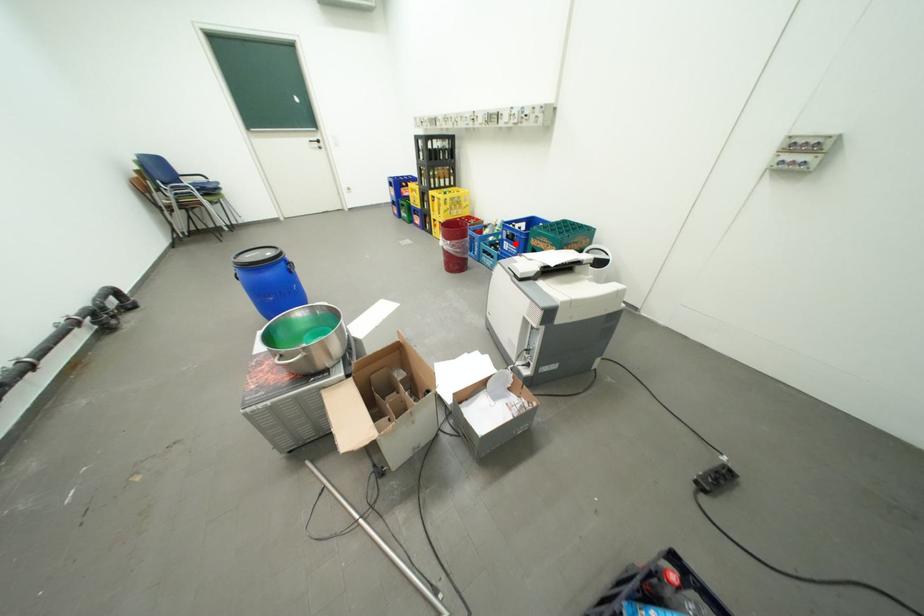
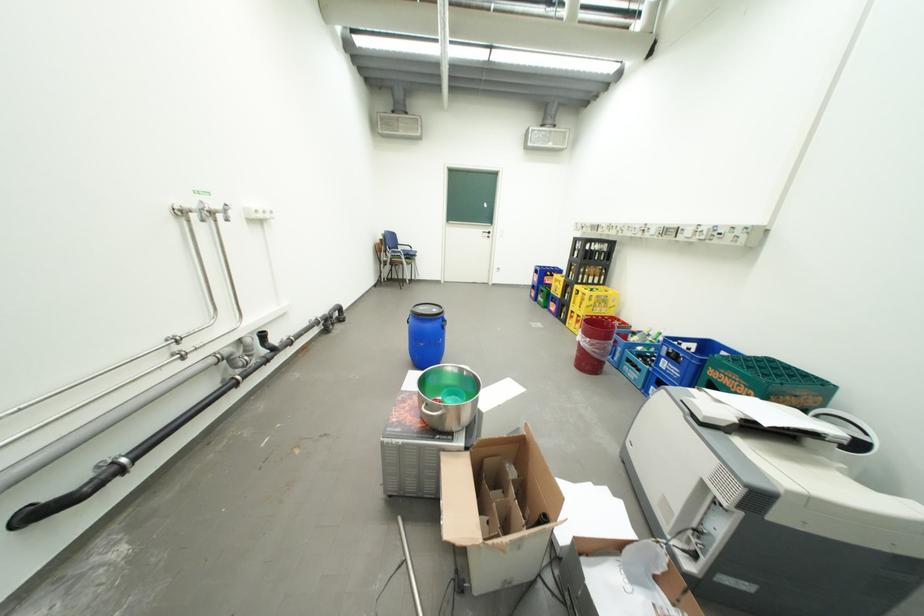
Question: I am providing you with two images of the same scene from different viewpoints. In image1, a red point is highlighted. Considering the same 3D point in image2, which of the following is correct?

Choices:
 (A) It is closer
 (B) It is farther

Answer: (A)